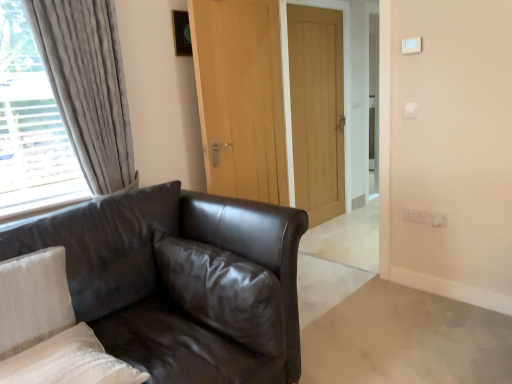
Question: Can matte black leather couch at left be found inside white plastic light switch at upper right, which ranks as the 2th light switch in front-to-back order?

Choices:
 (A) yes
 (B) no

Answer: (B)

Question: Is white plastic light switch at upper right, arranged as the second light switch when viewed from the top, wider than matte black leather couch at left?

Choices:
 (A) yes
 (B) no

Answer: (B)

Question: From the image's perspective, does white plastic light switch at upper right, which ranks as the first light switch in bottom-to-top order, appear lower than matte black leather couch at left?

Choices:
 (A) no
 (B) yes

Answer: (A)

Question: From a real-world perspective, is white plastic light switch at upper right, arranged as the second light switch when viewed from the top, on top of matte black leather couch at left?

Choices:
 (A) yes
 (B) no

Answer: (A)

Question: Is white plastic light switch at upper right, which ranks as the 2th light switch in front-to-back order, taller than matte black leather couch at left?

Choices:
 (A) yes
 (B) no

Answer: (B)

Question: In terms of height, does matte black leather couch at left look taller or shorter compared to glossy leather pillow at center, acting as the 1th pillow starting from the right?

Choices:
 (A) short
 (B) tall

Answer: (B)

Question: Considering the positions of matte black leather couch at left and glossy leather pillow at center, acting as the 1th pillow starting from the right, in the image, is matte black leather couch at left wider or thinner than glossy leather pillow at center, acting as the 1th pillow starting from the right,?

Choices:
 (A) wide
 (B) thin

Answer: (A)

Question: Considering their positions, is matte black leather couch at left located in front of or behind glossy leather pillow at center, positioned as the 3th pillow in left-to-right order?

Choices:
 (A) behind
 (B) front

Answer: (B)

Question: From a real-world perspective, is matte black leather couch at left above or below glossy leather pillow at center, acting as the 1th pillow starting from the right?

Choices:
 (A) below
 (B) above

Answer: (A)

Question: Is white plastic electric outlet at lower right, which appears as the 1th electric outlet when viewed from the right, in front of or behind light brown wooden door at center, positioned as the first door in right-to-left order, in the image?

Choices:
 (A) behind
 (B) front

Answer: (B)

Question: Is point (443, 221) closer or farther from the camera than point (295, 198)?

Choices:
 (A) closer
 (B) farther

Answer: (A)

Question: In terms of height, does white plastic electric outlet at lower right, positioned as the 1th electric outlet in front-to-back order, look taller or shorter compared to light brown wooden door at center, positioned as the first door in right-to-left order?

Choices:
 (A) tall
 (B) short

Answer: (B)

Question: Based on their positions, is white plastic electric outlet at lower right, which appears as the second electric outlet when viewed from the left, located to the left or right of light brown wooden door at center, marked as the 2th door in a front-to-back arrangement?

Choices:
 (A) right
 (B) left

Answer: (A)

Question: In terms of width, does light brown wooden door at center, the first door from the back, look wider or thinner when compared to matte black leather couch at left?

Choices:
 (A) wide
 (B) thin

Answer: (B)

Question: Visually, is light brown wooden door at center, marked as the 2th door in a front-to-back arrangement, positioned to the left or to the right of matte black leather couch at left?

Choices:
 (A) left
 (B) right

Answer: (B)